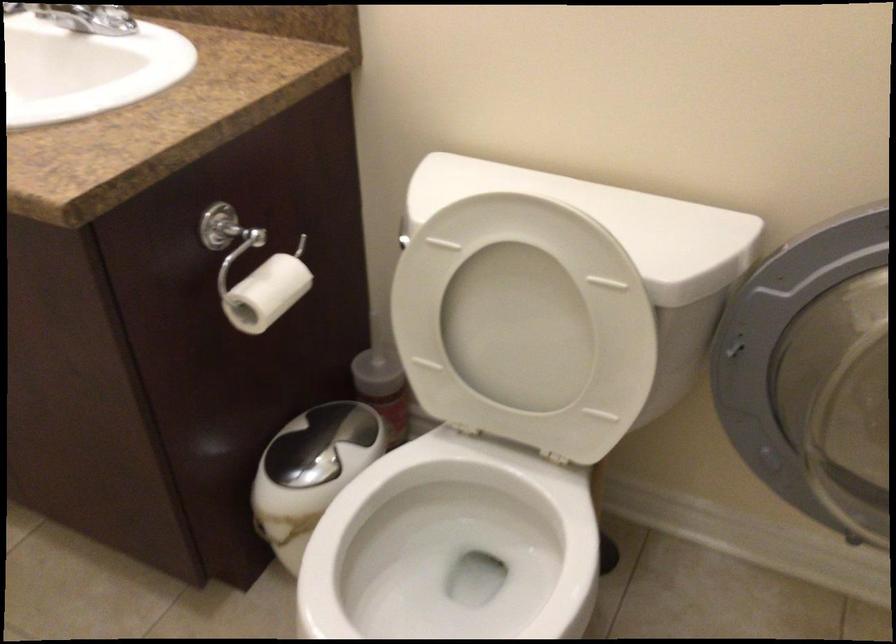
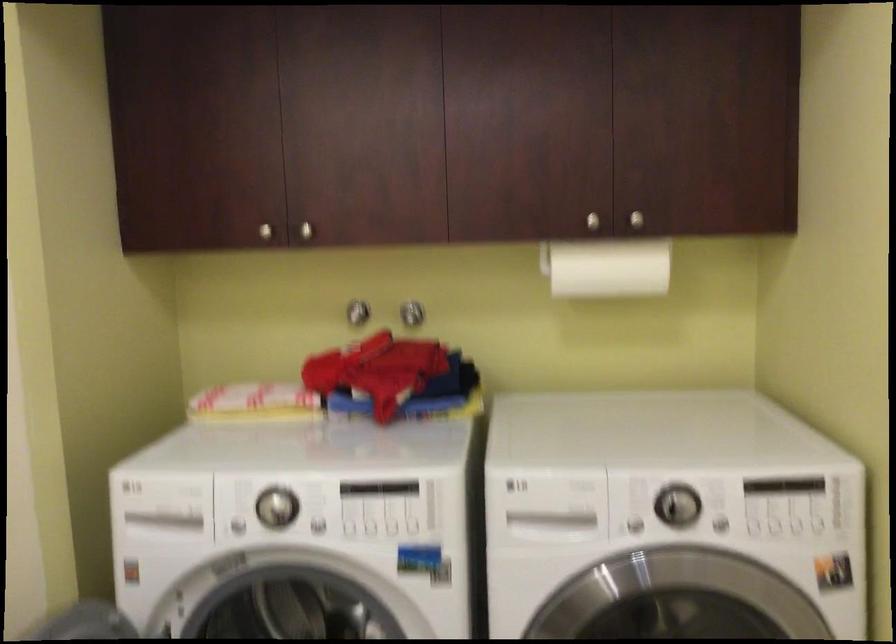
The images are taken continuously from a first-person perspective. In which direction is your viewpoint rotating?

The camera's rotation is toward right-down.